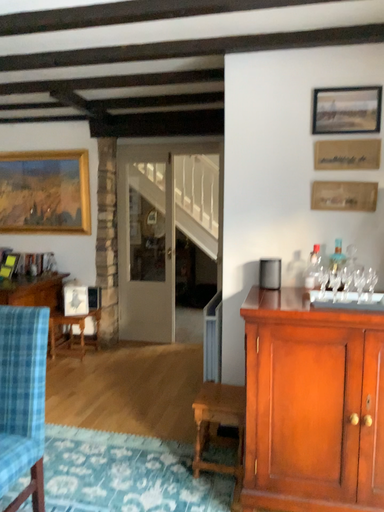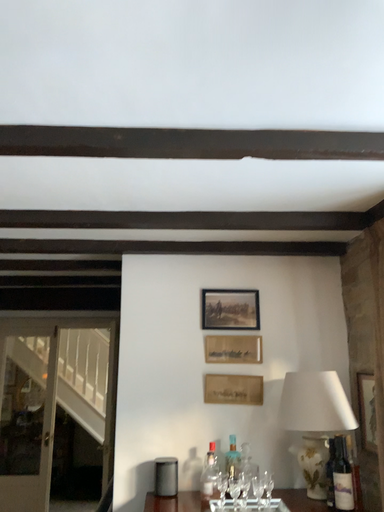
Question: How did the camera likely rotate when shooting the video?

Choices:
 (A) rotated upward
 (B) rotated downward

Answer: (A)